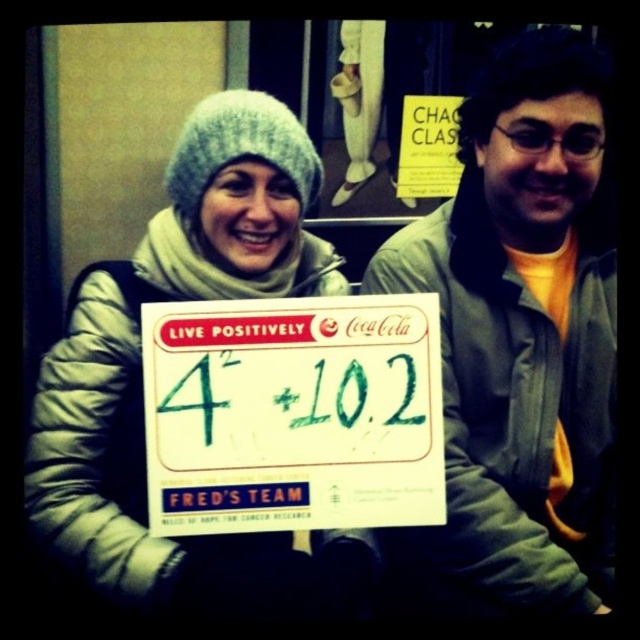
You are a photographer trying to capture both the green matte sign at right and the white paper sign at center in a single frame. Based on their sizes, which sign will appear bigger in your photo?

The green matte sign at right is larger in size than the white paper sign at center, so it will appear bigger in the photo.

You are a photographer taking a picture of the scene. The white knit hat at upper left and the white paper sign at center are both important elements. Which object is taller in the image?

The white knit hat at upper left is taller than the white paper sign at center.